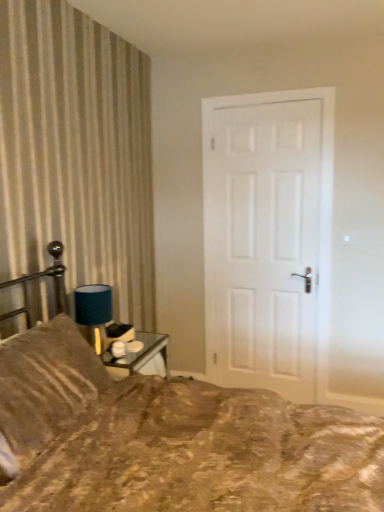
Question: Are brown textured pillow at left and brown textured fabric bed at lower left far apart?

Choices:
 (A) no
 (B) yes

Answer: (A)

Question: Is brown textured pillow at left completely or partially outside of brown textured fabric bed at lower left?

Choices:
 (A) no
 (B) yes

Answer: (A)

Question: Is brown textured pillow at left shorter than brown textured fabric bed at lower left?

Choices:
 (A) yes
 (B) no

Answer: (A)

Question: From a real-world perspective, is brown textured pillow at left physically below brown textured fabric bed at lower left?

Choices:
 (A) no
 (B) yes

Answer: (A)

Question: Is brown textured pillow at left in front of brown textured fabric bed at lower left?

Choices:
 (A) yes
 (B) no

Answer: (B)

Question: From a real-world perspective, is brown textured fabric bed at lower left above or below white matte door at center?

Choices:
 (A) above
 (B) below

Answer: (B)

Question: Considering the positions of brown textured fabric bed at lower left and white matte door at center in the image, is brown textured fabric bed at lower left bigger or smaller than white matte door at center?

Choices:
 (A) small
 (B) big

Answer: (B)

Question: Is brown textured fabric bed at lower left inside the boundaries of white matte door at center, or outside?

Choices:
 (A) inside
 (B) outside

Answer: (B)

Question: Is brown textured fabric bed at lower left wider or thinner than white matte door at center?

Choices:
 (A) wide
 (B) thin

Answer: (A)

Question: From the image's perspective, relative to blue fabric lampshade at upper left, is brown textured pillow at left above or below?

Choices:
 (A) below
 (B) above

Answer: (A)

Question: From a real-world perspective, is brown textured pillow at left positioned above or below blue fabric lampshade at upper left?

Choices:
 (A) above
 (B) below

Answer: (B)

Question: Considering the positions of brown textured pillow at left and blue fabric lampshade at upper left in the image, is brown textured pillow at left wider or thinner than blue fabric lampshade at upper left?

Choices:
 (A) wide
 (B) thin

Answer: (A)

Question: In terms of height, does brown textured pillow at left look taller or shorter compared to blue fabric lampshade at upper left?

Choices:
 (A) tall
 (B) short

Answer: (A)

Question: From the image's perspective, relative to blue fabric lampshade at upper left, is white matte door at center above or below?

Choices:
 (A) above
 (B) below

Answer: (A)

Question: Is white matte door at center inside the boundaries of blue fabric lampshade at upper left, or outside?

Choices:
 (A) outside
 (B) inside

Answer: (A)